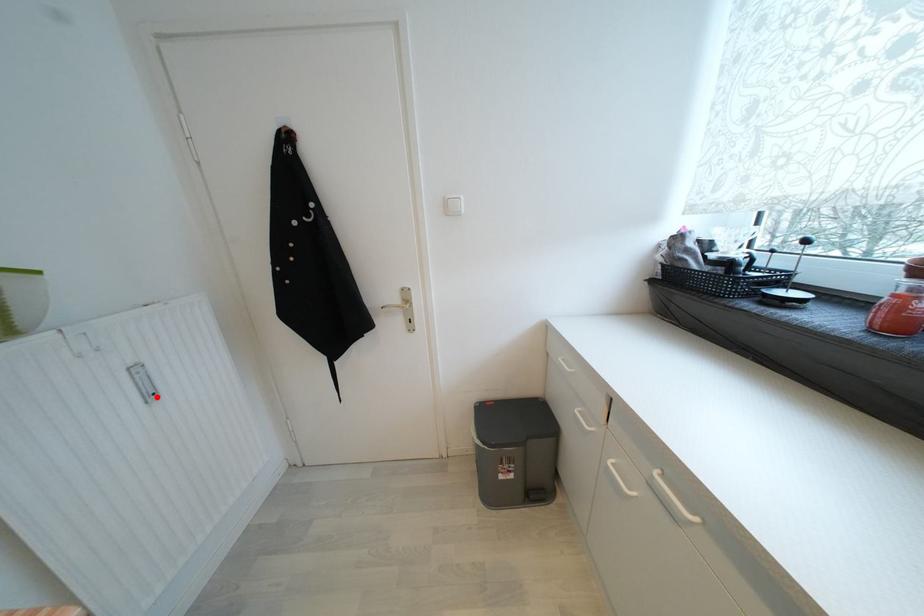
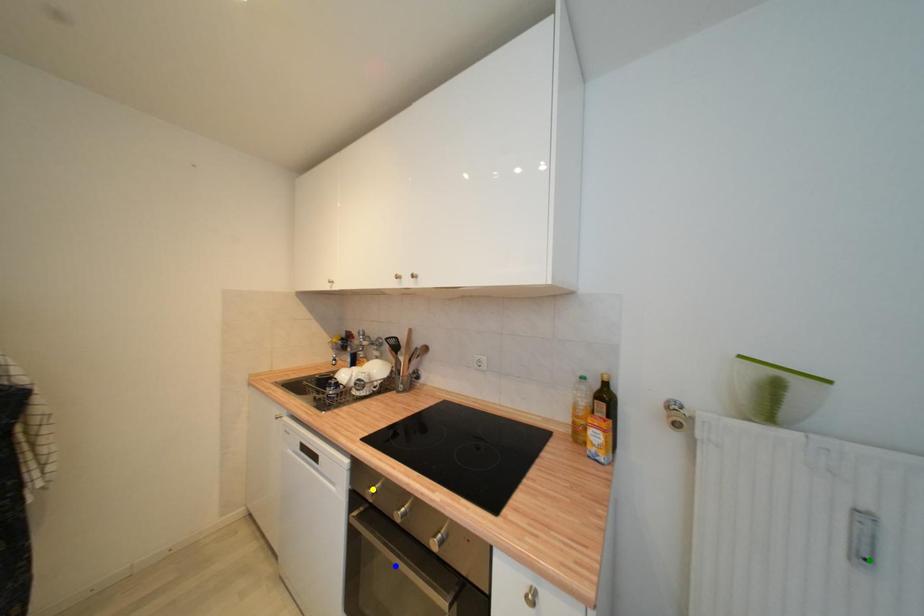
Question: I am providing you with two images of the same scene from different viewpoints. A red point is marked on the first image. You are given multiple points on the second image. Can you choose the point in image 2 that corresponds to the point in image 1?

Choices:
 (A) blue point
 (B) yellow point
 (C) green point

Answer: (C)